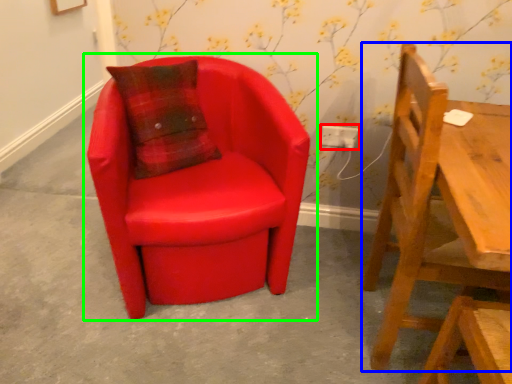
Question: Based on their relative distances, which object is nearer to electric outlet (highlighted by a red box)? Choose from chair (highlighted by a blue box) and chair (highlighted by a green box).

Choices:
 (A) chair
 (B) chair

Answer: (B)